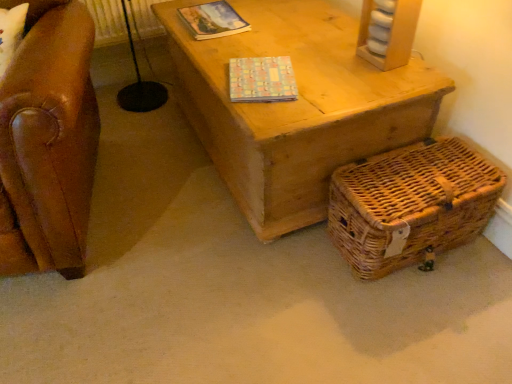
Question: Is multicolored paper book at upper center, which is the first magazine in top-to-bottom order, to the left of woven brown basket at lower right from the viewer's perspective?

Choices:
 (A) no
 (B) yes

Answer: (B)

Question: Is multicolored paper book at upper center, which is the first magazine in top-to-bottom order, outside woven brown basket at lower right?

Choices:
 (A) yes
 (B) no

Answer: (A)

Question: Considering the relative sizes of multicolored paper book at upper center, the second magazine in the front-to-back sequence, and woven brown basket at lower right in the image provided, is multicolored paper book at upper center, the second magazine in the front-to-back sequence, taller than woven brown basket at lower right?

Choices:
 (A) yes
 (B) no

Answer: (B)

Question: From a real-world perspective, is multicolored paper book at upper center, which is the first magazine in top-to-bottom order, on top of woven brown basket at lower right?

Choices:
 (A) no
 (B) yes

Answer: (B)

Question: Is multicolored paper book at upper center, the 1th magazine viewed from the back, far from woven brown basket at lower right?

Choices:
 (A) no
 (B) yes

Answer: (A)

Question: Based on their positions, is woven brown basket at lower right located to the left or right of pastel mosaic-patterned book at center, which ranks as the second magazine in back-to-front order?

Choices:
 (A) right
 (B) left

Answer: (A)

Question: From the image's perspective, is woven brown basket at lower right positioned above or below pastel mosaic-patterned book at center, which is the 1th magazine in bottom-to-top order?

Choices:
 (A) above
 (B) below

Answer: (B)

Question: Is point (373, 258) closer or farther from the camera than point (252, 89)?

Choices:
 (A) closer
 (B) farther

Answer: (A)

Question: Considering the positions of woven brown basket at lower right and pastel mosaic-patterned book at center, positioned as the first magazine in front-to-back order, in the image, is woven brown basket at lower right taller or shorter than pastel mosaic-patterned book at center, positioned as the first magazine in front-to-back order,?

Choices:
 (A) tall
 (B) short

Answer: (A)

Question: In the image, is woven brown basket at lower right on the left side or the right side of multicolored paper book at upper center, the 1th magazine viewed from the back?

Choices:
 (A) right
 (B) left

Answer: (A)

Question: In terms of size, does woven brown basket at lower right appear bigger or smaller than multicolored paper book at upper center, which is the first magazine in top-to-bottom order?

Choices:
 (A) small
 (B) big

Answer: (B)

Question: Is woven brown basket at lower right taller or shorter than multicolored paper book at upper center, the second magazine in the front-to-back sequence?

Choices:
 (A) short
 (B) tall

Answer: (B)

Question: From a real-world perspective, is woven brown basket at lower right positioned above or below multicolored paper book at upper center, the 1th magazine viewed from the back?

Choices:
 (A) below
 (B) above

Answer: (A)

Question: Is point (236, 97) closer or farther from the camera than point (219, 16)?

Choices:
 (A) farther
 (B) closer

Answer: (B)

Question: Based on their sizes in the image, would you say pastel mosaic-patterned book at center, marked as the second magazine in a top-to-bottom arrangement, is bigger or smaller than multicolored paper book at upper center, which is the second magazine in bottom-to-top order?

Choices:
 (A) big
 (B) small

Answer: (B)